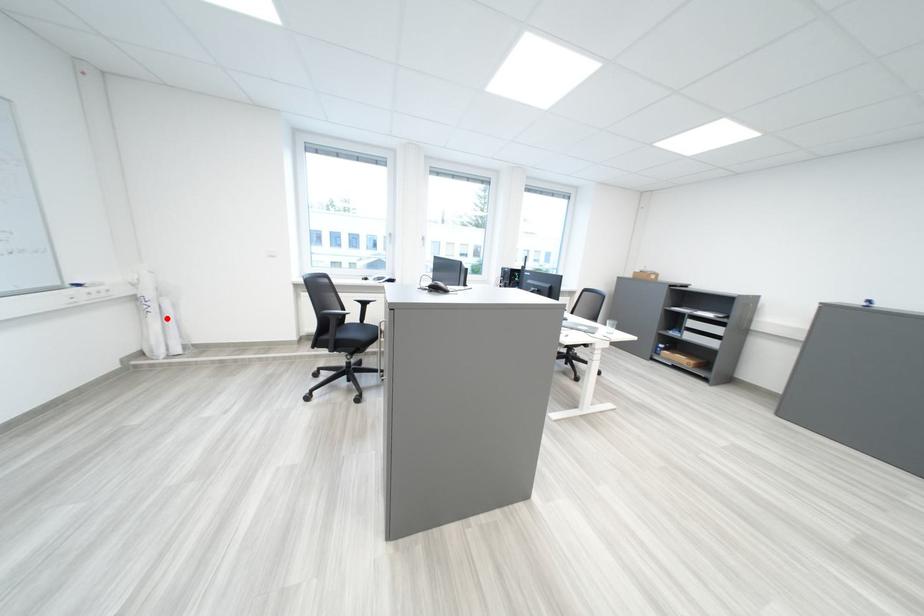
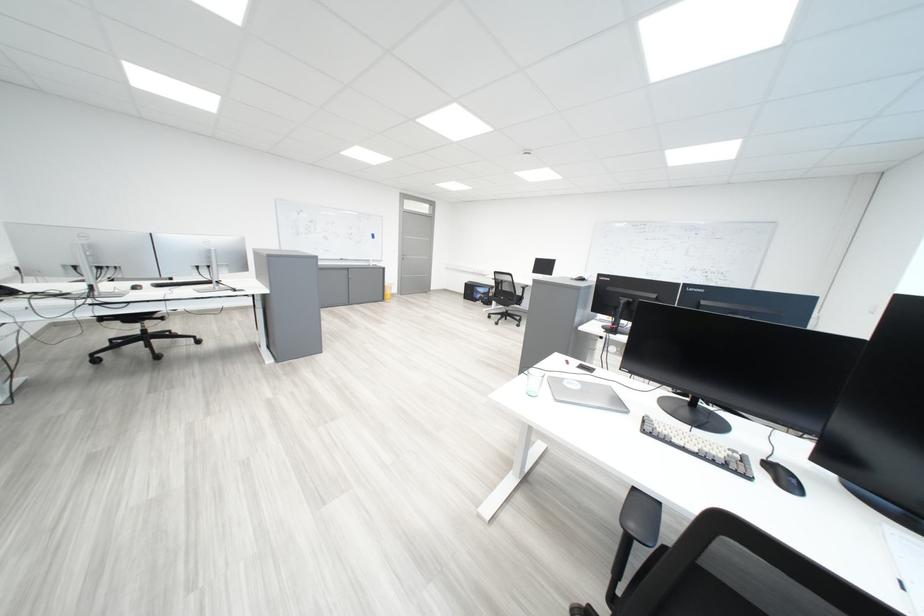
Question: I am providing you with two images of the same scene from different viewpoints. A red point is marked on the first image. At the location where the point appears in image 1, is it still visible in image 2?

Choices:
 (A) Yes
 (B) No

Answer: (B)